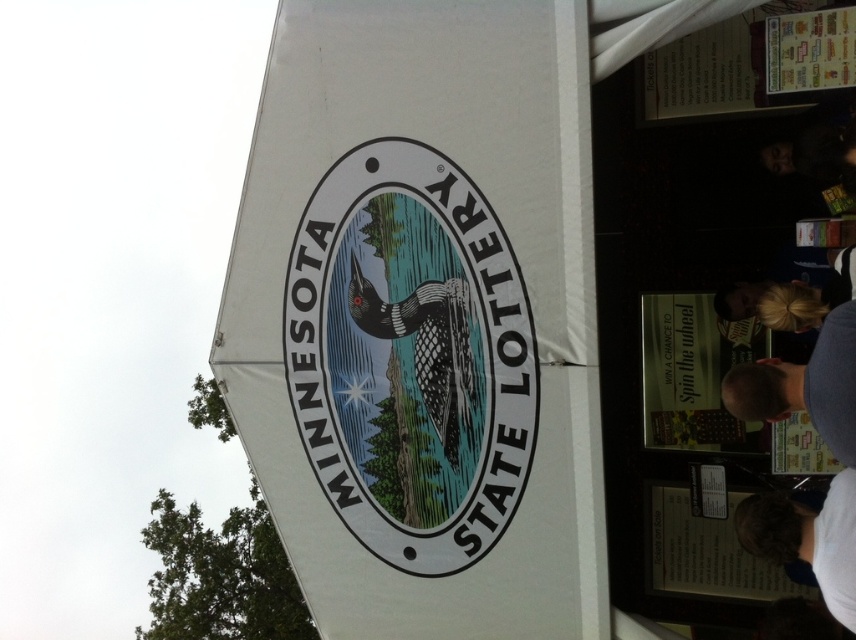
Question: Which of the following is the closest to the observer?

Choices:
 (A) (847, 625)
 (B) (354, 163)
 (C) (562, 396)

Answer: (A)

Question: Does white fabric canopy at center appear under wooden signboard at center?

Choices:
 (A) no
 (B) yes

Answer: (A)

Question: In this image, where is white fabric canopy at center located relative to white t-shirt at lower right?

Choices:
 (A) left
 (B) right

Answer: (A)

Question: Which is farther from the blue shirt at right?

Choices:
 (A) white t-shirt at lower right
 (B) white fabric canopy at center
 (C) wooden signboard at center

Answer: (B)

Question: Does white fabric canopy at center appear on the left side of white t-shirt at lower right?

Choices:
 (A) yes
 (B) no

Answer: (A)

Question: Among these objects, which one is farthest from the camera?

Choices:
 (A) white t-shirt at lower right
 (B) wooden signboard at center
 (C) white fabric canopy at center
 (D) blue shirt at right

Answer: (C)